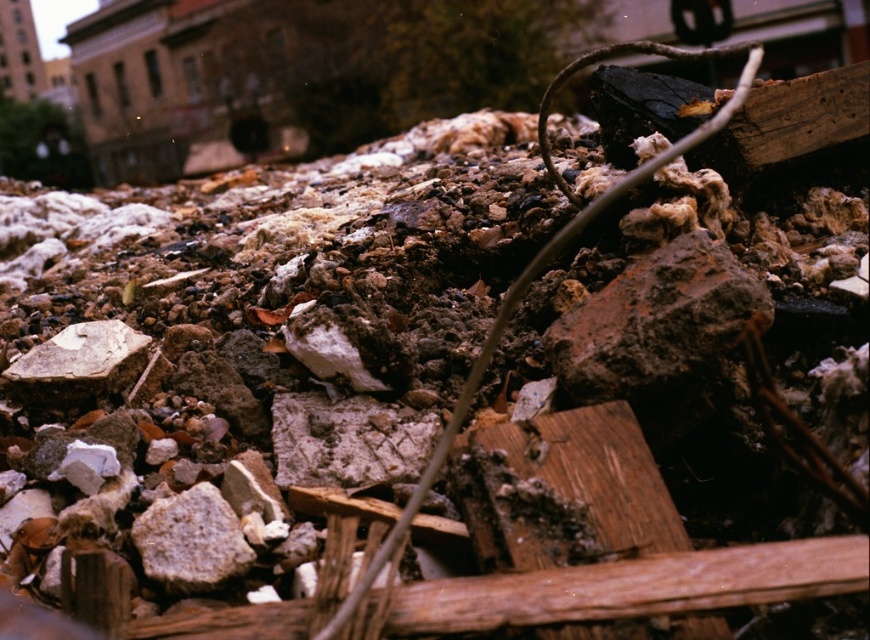
In the scene shown: Is gray rough stone at center bigger than white rough stone at center-left?

Incorrect, gray rough stone at center is not larger than white rough stone at center-left.

Which of these two, gray rough stone at center or white rough stone at center-left, stands taller?

white rough stone at center-left is taller.

In the scene shown: Who is more distant from viewer, (171, 545) or (114, 371)?

The point (114, 371) is more distant.

Find the location of `gray rough stone at center`. gray rough stone at center is located at coordinates [x=191, y=541].

Is rusty metal rock at center to the left of gray rough stone at center from the viewer's perspective?

Incorrect, rusty metal rock at center is not on the left side of gray rough stone at center.

Looking at this image, who is taller, rusty metal rock at center or gray rough stone at center?

Standing taller between the two is rusty metal rock at center.

Is point (627, 364) positioned in front of point (179, 506)?

No, (627, 364) is behind (179, 506).

Where is `rusty metal rock at center`? rusty metal rock at center is located at coordinates (657, 324).

Who is more forward, (688, 340) or (134, 339)?

Point (688, 340) is more forward.

At what (x,y) coordinates should I click in order to perform the action: click on rusty metal rock at center. Please return your answer as a coordinate pair (x, y). The width and height of the screenshot is (870, 640). Looking at the image, I should click on (657, 324).